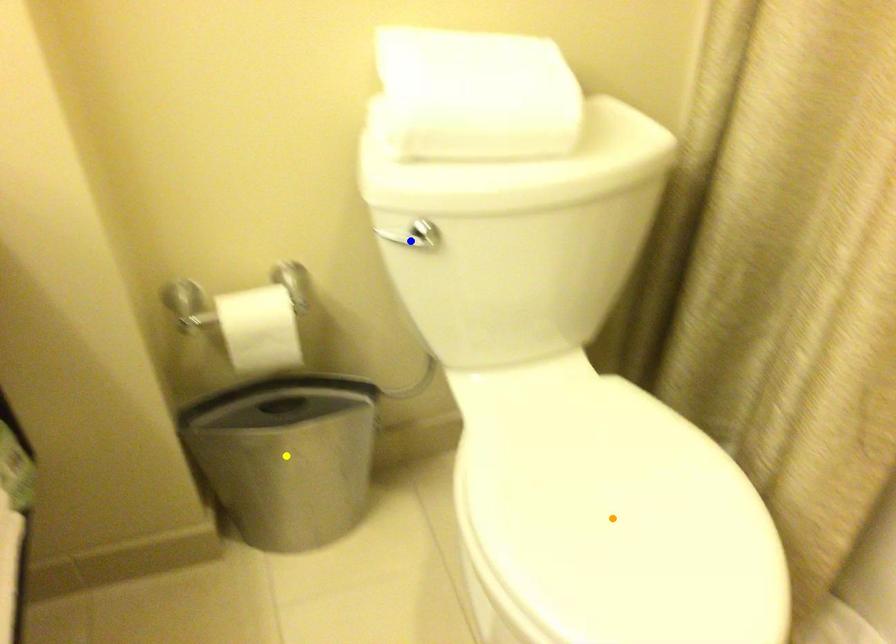
Order these from farthest to nearest:
1. yellow point
2. blue point
3. orange point

yellow point → blue point → orange point